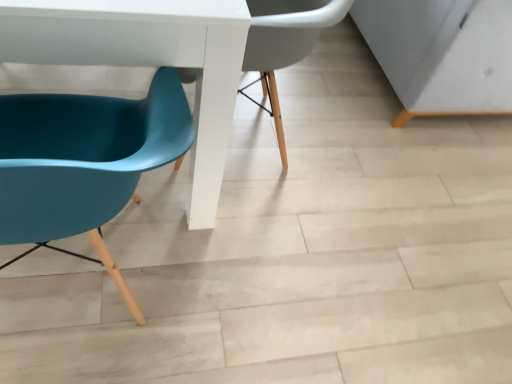
Question: Is white glossy table at lower left in front of or behind teal plastic chair at left, the second chair when ordered from bottom to top, in the image?

Choices:
 (A) behind
 (B) front

Answer: (B)

Question: Does point tap(95, 29) appear closer or farther from the camera than point tap(295, 41)?

Choices:
 (A) closer
 (B) farther

Answer: (A)

Question: Which of these objects is positioned closest to the teal plastic chair at left, arranged as the 1th chair when ordered from the bottom?

Choices:
 (A) teal plastic chair at left, the 1th chair viewed from the top
 (B) white glossy table at lower left

Answer: (B)

Question: Estimate the real-world distances between objects in this image. Which object is farther from the teal plastic chair at left, arranged as the 1th chair when ordered from the bottom?

Choices:
 (A) white glossy table at lower left
 (B) teal plastic chair at left, the second chair when ordered from bottom to top

Answer: (B)